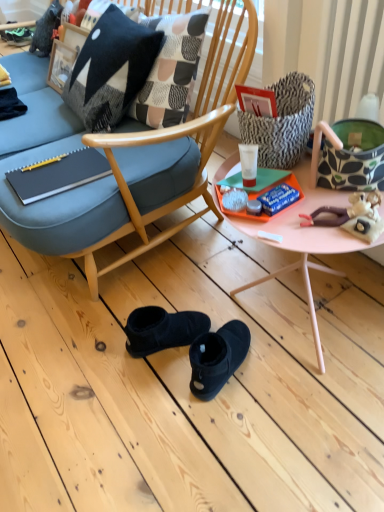
Question: From the image's perspective, is black woolen pillow at upper left above matte black notebook at left?

Choices:
 (A) no
 (B) yes

Answer: (B)

Question: Is the depth of black woolen pillow at upper left greater than that of matte black notebook at left?

Choices:
 (A) no
 (B) yes

Answer: (A)

Question: Considering the relative sizes of black woolen pillow at upper left and matte black notebook at left in the image provided, is black woolen pillow at upper left smaller than matte black notebook at left?

Choices:
 (A) yes
 (B) no

Answer: (B)

Question: From a real-world perspective, is black woolen pillow at upper left positioned under matte black notebook at left based on gravity?

Choices:
 (A) yes
 (B) no

Answer: (B)

Question: Is black woolen pillow at upper left turned away from matte black notebook at left?

Choices:
 (A) yes
 (B) no

Answer: (B)

Question: Does black woolen pillow at upper left have a lesser height compared to matte black notebook at left?

Choices:
 (A) yes
 (B) no

Answer: (B)

Question: From the image's perspective, is white glossy cream at center located beneath pink plastic tray at center?

Choices:
 (A) no
 (B) yes

Answer: (A)

Question: Is white glossy cream at center positioned with its back to pink plastic tray at center?

Choices:
 (A) no
 (B) yes

Answer: (A)

Question: Is white glossy cream at center positioned behind pink plastic tray at center?

Choices:
 (A) no
 (B) yes

Answer: (B)

Question: Considering the relative sizes of white glossy cream at center and pink plastic tray at center in the image provided, is white glossy cream at center smaller than pink plastic tray at center?

Choices:
 (A) yes
 (B) no

Answer: (A)

Question: Is white glossy cream at center not within pink plastic tray at center?

Choices:
 (A) yes
 (B) no

Answer: (A)

Question: Is white glossy cream at center wider than pink plastic tray at center?

Choices:
 (A) yes
 (B) no

Answer: (B)

Question: Is white glossy cream at center facing away from matte black notebook at left?

Choices:
 (A) yes
 (B) no

Answer: (B)